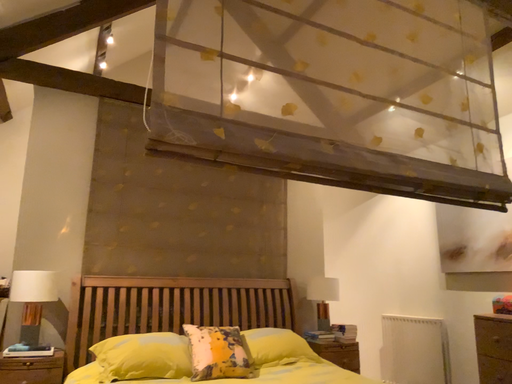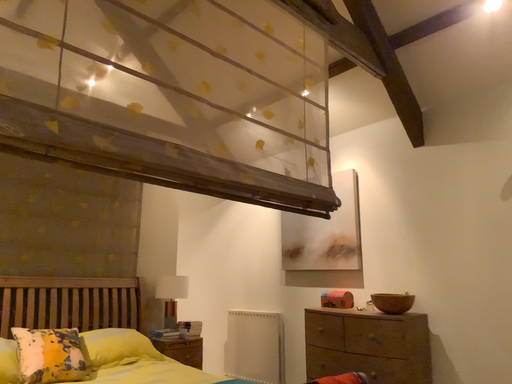
Question: Which way did the camera rotate in the video?

Choices:
 (A) rotated right
 (B) rotated left

Answer: (A)